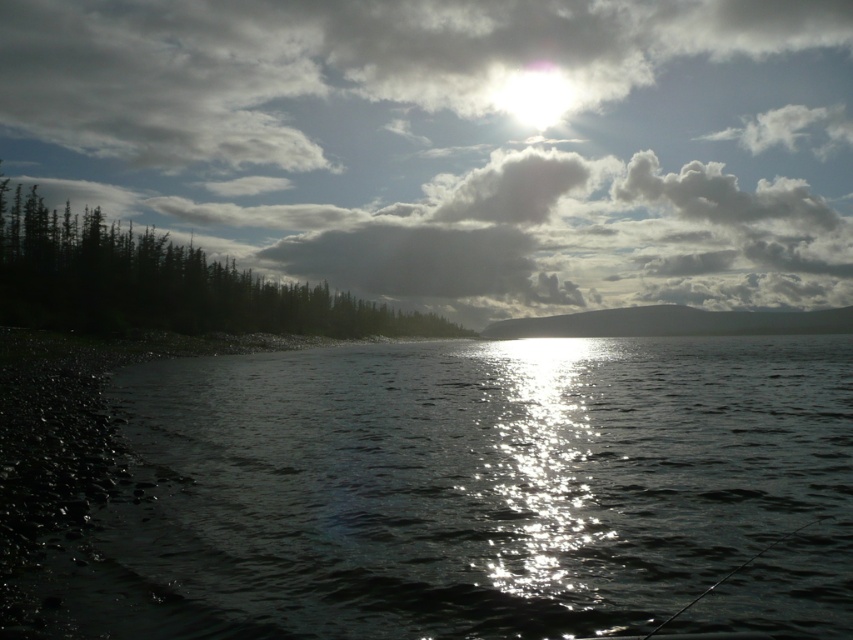
Where is `glistening water at center`? The width and height of the screenshot is (853, 640). glistening water at center is located at coordinates (428, 490).

Is glistening water at center shorter than black rod fishing pole at lower right?

In fact, glistening water at center may be taller than black rod fishing pole at lower right.

Where is `glistening water at center`? Image resolution: width=853 pixels, height=640 pixels. glistening water at center is located at coordinates (428, 490).

Between green matte trees at left and black rod fishing pole at lower right, which one has less height?

With less height is black rod fishing pole at lower right.

This screenshot has width=853, height=640. Describe the element at coordinates (161, 284) in the screenshot. I see `green matte trees at left` at that location.

The width and height of the screenshot is (853, 640). In order to click on green matte trees at left in this screenshot , I will do `click(161, 284)`.

Who is more distant from viewer, (187, 68) or (782, 540)?

The point (187, 68) is behind.

Between cloudy sky at upper center and black rod fishing pole at lower right, which one appears on the right side from the viewer's perspective?

black rod fishing pole at lower right

The height and width of the screenshot is (640, 853). Find the location of `cloudy sky at upper center`. cloudy sky at upper center is located at coordinates pos(457,141).